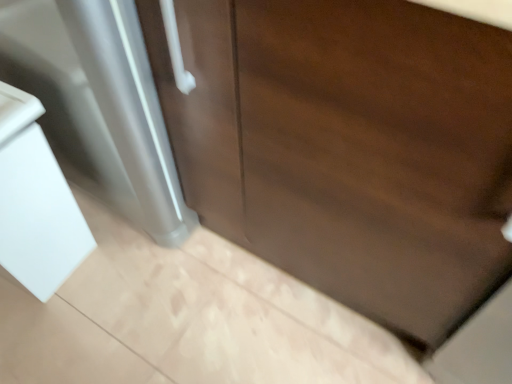
Locate an element on the screen. The image size is (512, 384). vacant area that is situated to the right of white glossy sink at lower left is located at coordinates (130, 273).